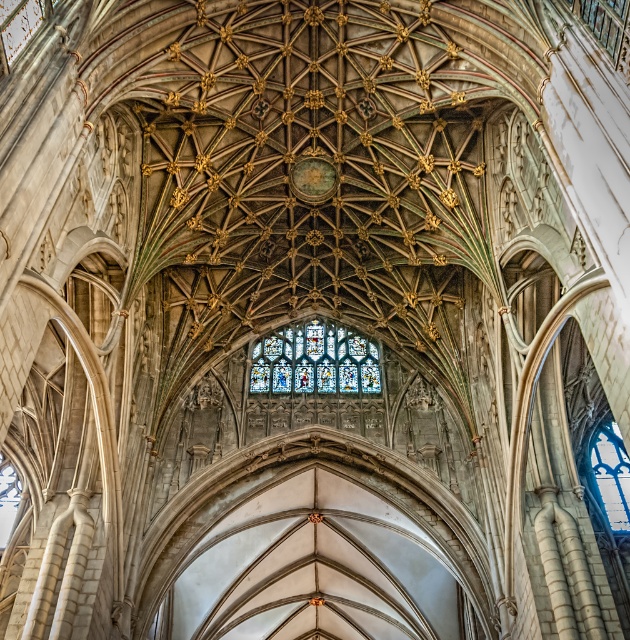
Question: Which point is farther from the camera taking this photo?

Choices:
 (A) tap(617, 525)
 (B) tap(297, 342)

Answer: (B)

Question: Does stained glass at center appear on the right side of blue glass window at center?

Choices:
 (A) no
 (B) yes

Answer: (A)

Question: Among these points, which one is nearest to the camera?

Choices:
 (A) (311, 324)
 (B) (627, 509)

Answer: (B)

Question: Can you confirm if stained glass at center is positioned above blue glass window at center?

Choices:
 (A) no
 (B) yes

Answer: (B)

Question: Does stained glass at center have a larger size compared to blue glass window at center?

Choices:
 (A) yes
 (B) no

Answer: (A)